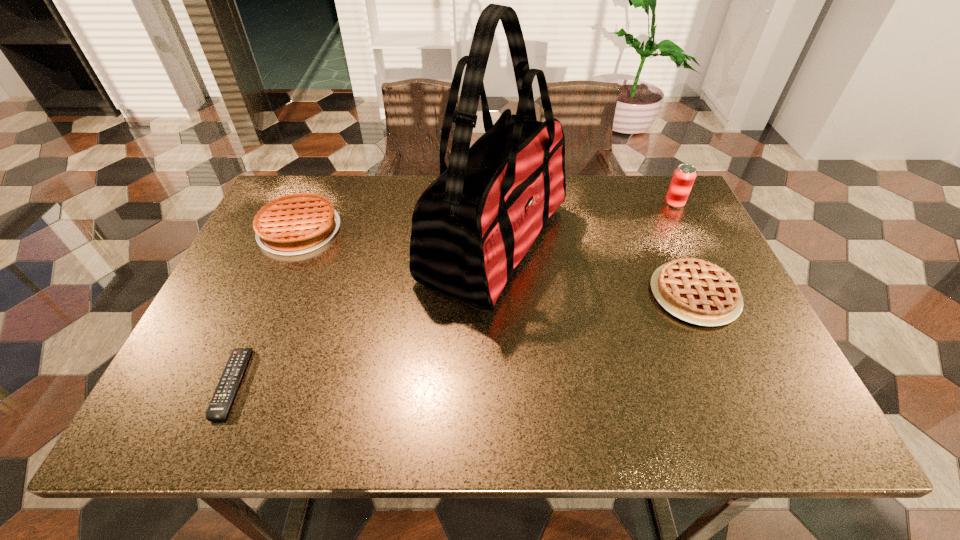
This screenshot has height=540, width=960. I want to click on the third object from right to left, so click(471, 227).

Identify the location of duffel bag. The width and height of the screenshot is (960, 540). (471, 227).

Identify the location of the second tallest object. (684, 176).

Locate an element on the screen. This screenshot has width=960, height=540. the third shortest object is located at coordinates (298, 223).

Identify the location of the taller pie. This screenshot has width=960, height=540. (298, 223).

Locate an element on the screen. The width and height of the screenshot is (960, 540). the shorter pie is located at coordinates (699, 292).

The image size is (960, 540). I want to click on the right pie, so click(x=699, y=292).

I want to click on remote control, so click(x=218, y=408).

Where is `the shortest object`? the shortest object is located at coordinates (218, 408).

Where is `free space located 0.380m on the left of the tallest object`? Image resolution: width=960 pixels, height=540 pixels. free space located 0.380m on the left of the tallest object is located at coordinates (276, 242).